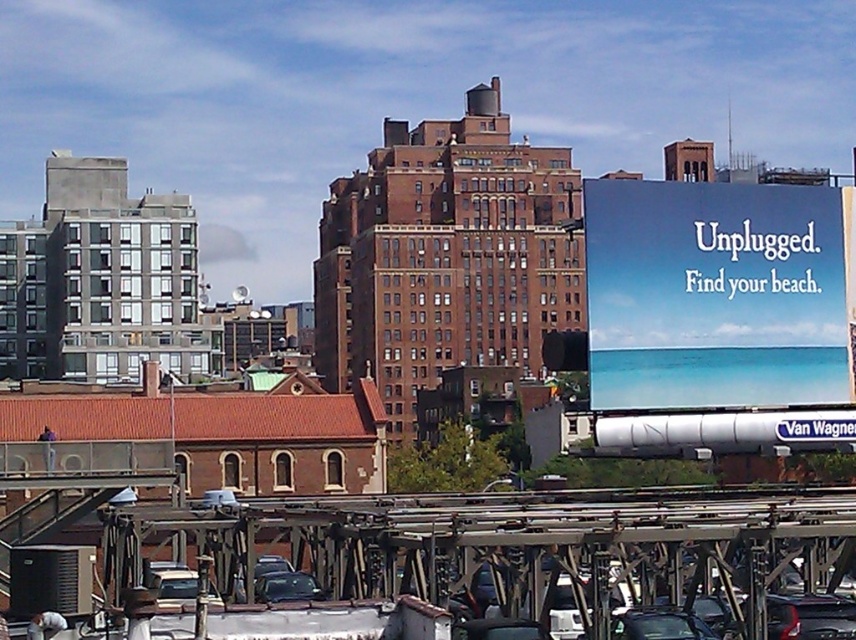
Question: From the image, what is the correct spatial relationship of metallic gray overpass at lower center in relation to shiny black car at center?

Choices:
 (A) below
 (B) above

Answer: (B)

Question: Based on their relative distances, which object is nearer to the blue glossy billboard at upper right?

Choices:
 (A) shiny black sedan at center
 (B) metallic gray overpass at lower center
 (C) shiny black car at center

Answer: (B)

Question: Which of these objects is positioned closest to the metallic gray overpass at lower center?

Choices:
 (A) blue glossy billboard at upper right
 (B) shiny black car at center

Answer: (B)

Question: Does metallic gray overpass at lower center have a larger size compared to shiny black sedan at center?

Choices:
 (A) yes
 (B) no

Answer: (A)

Question: Can you confirm if metallic gray overpass at lower center is positioned above shiny black sedan at center?

Choices:
 (A) yes
 (B) no

Answer: (A)

Question: Which object appears closest to the camera in this image?

Choices:
 (A) shiny black car at center
 (B) metallic gray overpass at lower center
 (C) blue glossy billboard at upper right
 (D) shiny black sedan at center

Answer: (B)